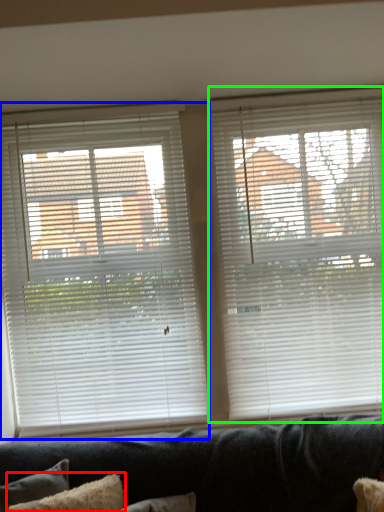
Question: Which is farther away from pillow (highlighted by a red box)? window blind (highlighted by a blue box) or window blind (highlighted by a green box)?

Choices:
 (A) window blind
 (B) window blind

Answer: (B)